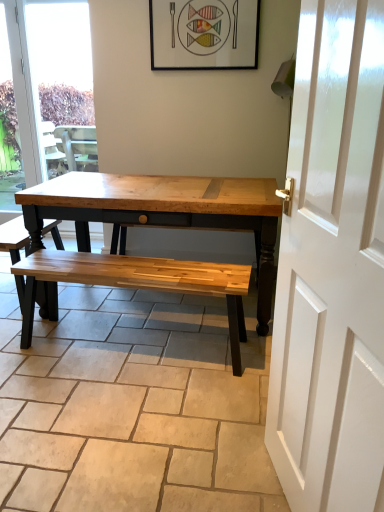
This screenshot has height=512, width=384. I want to click on matte black picture frame at upper center, so click(x=204, y=34).

This screenshot has height=512, width=384. Describe the element at coordinates (14, 238) in the screenshot. I see `wooden bench at center` at that location.

What do you see at coordinates (44, 94) in the screenshot?
I see `transparent glass window at upper left` at bounding box center [44, 94].

Locate an element on the screen. The height and width of the screenshot is (512, 384). matte black picture frame at upper center is located at coordinates (204, 34).

Locate an element on the screen. The height and width of the screenshot is (512, 384). church bench below the matte black picture frame at upper center (from the image's perspective) is located at coordinates (14, 238).

Who is taller, matte black picture frame at upper center or wooden bench at center?

Standing taller between the two is wooden bench at center.

Considering the positions of objects matte black picture frame at upper center and wooden bench at center in the image provided, who is more to the left, matte black picture frame at upper center or wooden bench at center?

wooden bench at center.

In the scene shown: From their relative heights in the image, would you say matte black picture frame at upper center is taller or shorter than transparent glass window at upper left?

matte black picture frame at upper center is shorter than transparent glass window at upper left.

From the image's perspective, relative to transparent glass window at upper left, is matte black picture frame at upper center above or below?

Clearly, from the image's perspective, matte black picture frame at upper center is above transparent glass window at upper left.

At what (x,y) coordinates should I click in order to perform the action: click on picture frame lying above the transparent glass window at upper left (from the image's perspective). Please return your answer as a coordinate pair (x, y). This screenshot has height=512, width=384. Looking at the image, I should click on (204, 34).

From a real-world perspective, is transparent glass window at upper left under natural wood bench at center?

No, from a real-world perspective, transparent glass window at upper left is not under natural wood bench at center.

Is transparent glass window at upper left positioned far away from natural wood bench at center?

That's right, there is a large distance between transparent glass window at upper left and natural wood bench at center.

Is point (66, 138) closer or farther from the camera than point (264, 392)?

Point (66, 138) appears to be farther away from the viewer than point (264, 392).

Can you confirm if wooden bench at center is shorter than natural wood bench at center?

In fact, wooden bench at center may be taller than natural wood bench at center.

Does wooden bench at center turn towards natural wood bench at center?

No, wooden bench at center is not oriented towards natural wood bench at center.

Looking at this image, in the image, is wooden bench at center on the left side or the right side of natural wood bench at center?

Clearly, wooden bench at center is on the left of natural wood bench at center in the image.

How far apart are wooden bench at center and transparent glass window at upper left?

A distance of 7.71 feet exists between wooden bench at center and transparent glass window at upper left.

Would you say wooden bench at center is outside transparent glass window at upper left?

Indeed, wooden bench at center is completely outside transparent glass window at upper left.

From the image's perspective, between wooden bench at center and transparent glass window at upper left, who is located below?

wooden bench at center is shown below in the image.

Does wooden bench at center lie in front of transparent glass window at upper left?

Yes.

Is natural wood bench at center oriented away from matte black picture frame at upper center?

natural wood bench at center does not have its back to matte black picture frame at upper center.

Consider the image. Considering the relative sizes of natural wood bench at center and matte black picture frame at upper center in the image provided, is natural wood bench at center taller than matte black picture frame at upper center?

No, natural wood bench at center is not taller than matte black picture frame at upper center.

From the image's perspective, is natural wood bench at center on top of matte black picture frame at upper center?

Actually, natural wood bench at center appears below matte black picture frame at upper center in the image.

Is natural wood bench at center positioned with its back to wooden bench at center?

natural wood bench at center does not have its back to wooden bench at center.

Considering the sizes of objects natural wood bench at center and wooden bench at center in the image provided, who is bigger, natural wood bench at center or wooden bench at center?

natural wood bench at center is bigger.

From the image's perspective, which is below, natural wood bench at center or wooden bench at center?

natural wood bench at center.

The width and height of the screenshot is (384, 512). What are the coordinates of `church bench located on the left of matte black picture frame at upper center` in the screenshot? It's located at (14, 238).

Locate an element on the screen. window behind the matte black picture frame at upper center is located at coordinates (44, 94).

Looking at the image, which one is located further to natural wood bench at center, wooden bench at center or transparent glass window at upper left?

transparent glass window at upper left is positioned further to the anchor natural wood bench at center.

Estimate the real-world distances between objects in this image. Which object is further from wooden bench at center, transparent glass window at upper left or matte black picture frame at upper center?

transparent glass window at upper left lies further to wooden bench at center than the other object.

Which object lies further to the anchor point transparent glass window at upper left, wooden bench at center or natural wood bench at center?

The object further to transparent glass window at upper left is natural wood bench at center.

Based on their spatial positions, is transparent glass window at upper left or wooden bench at center further from matte black picture frame at upper center?

Based on the image, transparent glass window at upper left appears to be further to matte black picture frame at upper center.

Estimate the real-world distances between objects in this image. Which object is further from wooden bench at center, transparent glass window at upper left or natural wood bench at center?

Among the two, transparent glass window at upper left is located further to wooden bench at center.

Estimate the real-world distances between objects in this image. Which object is closer to wooden bench at center, matte black picture frame at upper center or transparent glass window at upper left?

matte black picture frame at upper center lies closer to wooden bench at center than the other object.

Considering their positions, is matte black picture frame at upper center positioned further to transparent glass window at upper left than wooden bench at center?

Based on the image, wooden bench at center appears to be further to transparent glass window at upper left.

Which object lies further to the anchor point natural wood bench at center, transparent glass window at upper left or wooden bench at center?

Based on the image, transparent glass window at upper left appears to be further to natural wood bench at center.

Where is `picture frame located between natural wood bench at center and transparent glass window at upper left in the depth direction`? picture frame located between natural wood bench at center and transparent glass window at upper left in the depth direction is located at coordinates (204, 34).

Image resolution: width=384 pixels, height=512 pixels. Find the location of `church bench between matte black picture frame at upper center and natural wood bench at center in the vertical direction`. church bench between matte black picture frame at upper center and natural wood bench at center in the vertical direction is located at coordinates (14, 238).

Identify the location of window between matte black picture frame at upper center and wooden bench at center vertically. (44, 94).

This screenshot has height=512, width=384. What are the coordinates of `church bench between natural wood bench at center and transparent glass window at upper left in the front-back direction` in the screenshot? It's located at (14, 238).